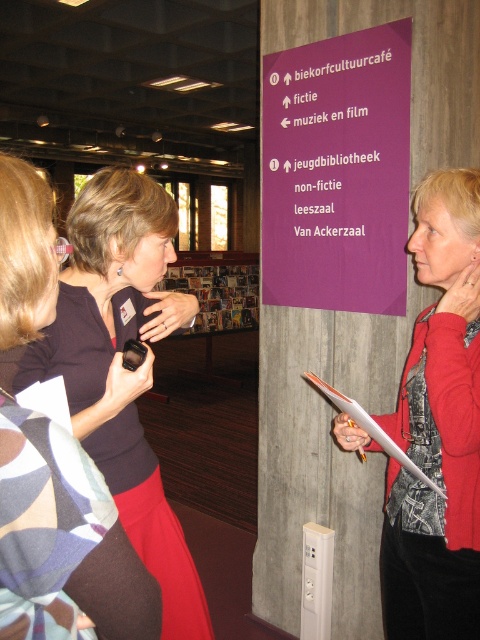
This screenshot has height=640, width=480. What do you see at coordinates (122, 368) in the screenshot?
I see `matte black phone at center` at bounding box center [122, 368].

Does matte black phone at center appear on the right side of white paper clipboard at right?

No, matte black phone at center is not to the right of white paper clipboard at right.

Identify the location of matte black phone at center. The width and height of the screenshot is (480, 640). (122, 368).

The width and height of the screenshot is (480, 640). I want to click on matte black phone at center, so click(x=122, y=368).

Which is more to the left, red matte jacket at center or matte black phone at center?

matte black phone at center is more to the left.

Can you confirm if red matte jacket at center is smaller than matte black phone at center?

Indeed, red matte jacket at center has a smaller size compared to matte black phone at center.

Find the location of `red matte jacket at center`. red matte jacket at center is located at coordinates (437, 428).

You are a GUI agent. You are given a task and a screenshot of the screen. Output one action in this format:
    pyautogui.click(x=<x>, y=<y>)
    Task: Click on the red matte jacket at center
    This screenshot has width=480, height=640.
    Given the screenshot: What is the action you would take?
    pyautogui.click(x=437, y=428)

Consider the image. Between red matte jacket at center and white paper clipboard at right, which one appears on the right side from the viewer's perspective?

red matte jacket at center

Does red matte jacket at center appear over white paper clipboard at right?

No, red matte jacket at center is not above white paper clipboard at right.

Who is more distant from viewer, (443, 474) or (376, 440)?

The point (443, 474) is more distant.

Locate an element on the screen. red matte jacket at center is located at coordinates (437, 428).